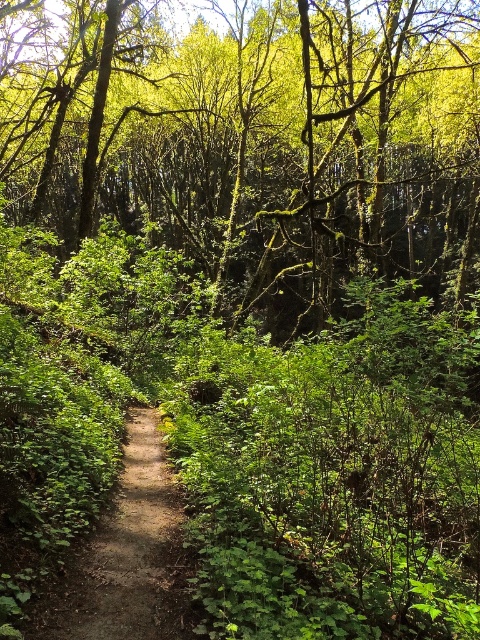
You are a hiker walking along the dirt path at center and want to reach the green leafy tree at center. Which direction should you turn to face the tree?

The green leafy tree at center is to the right of the dirt path at center, so you should turn to your right to face the tree.

Based on the photo, you are a hiker trying to navigate through the forest. You notice a green leafy tree at center and a dirt path at center. Which one is wider?

The green leafy tree at center is wider than the dirt path at center according to the description.